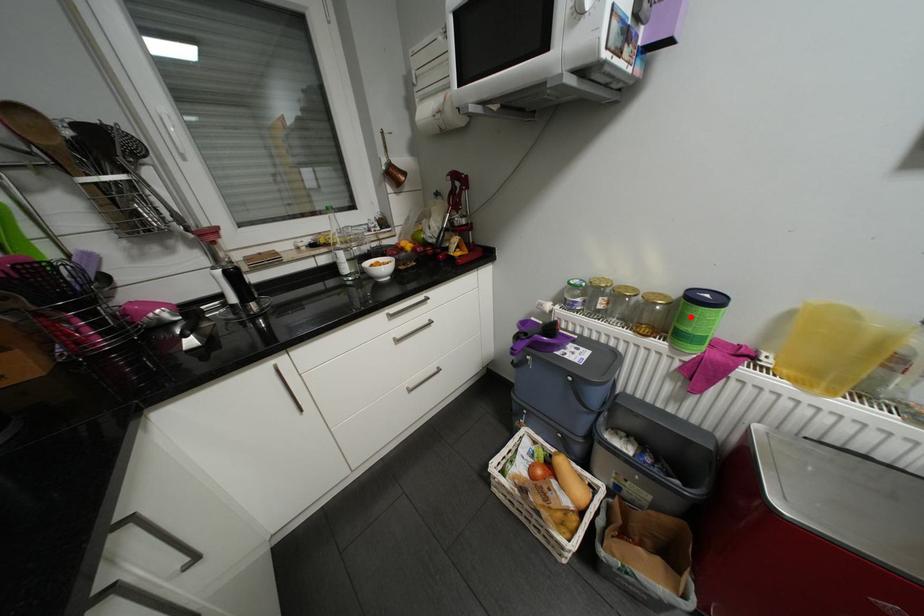
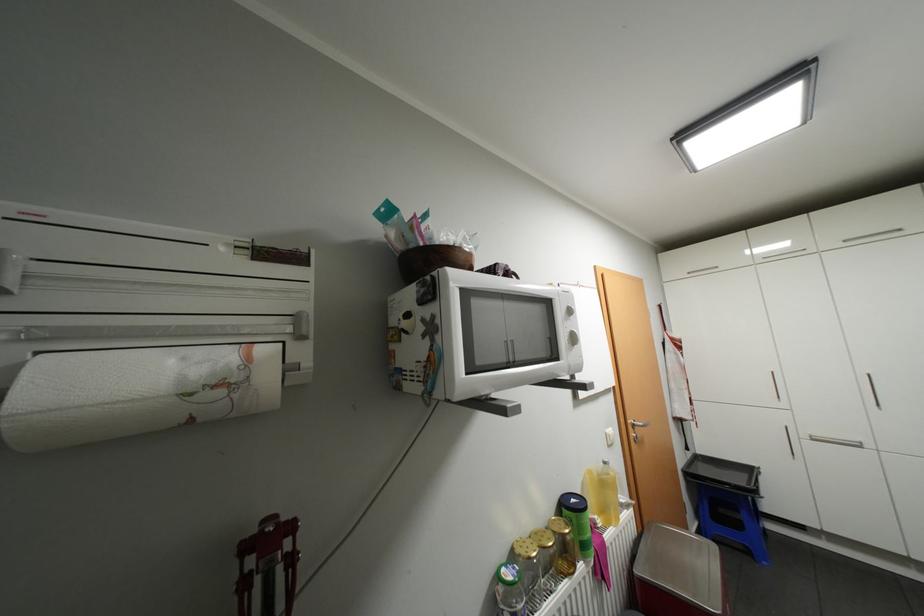
Question: I am providing you with two images of the same scene from different viewpoints. A red point is shown in image1. For the corresponding object point in image2, is it positioned nearer or farther from the camera?

Choices:
 (A) Nearer
 (B) Farther

Answer: (B)